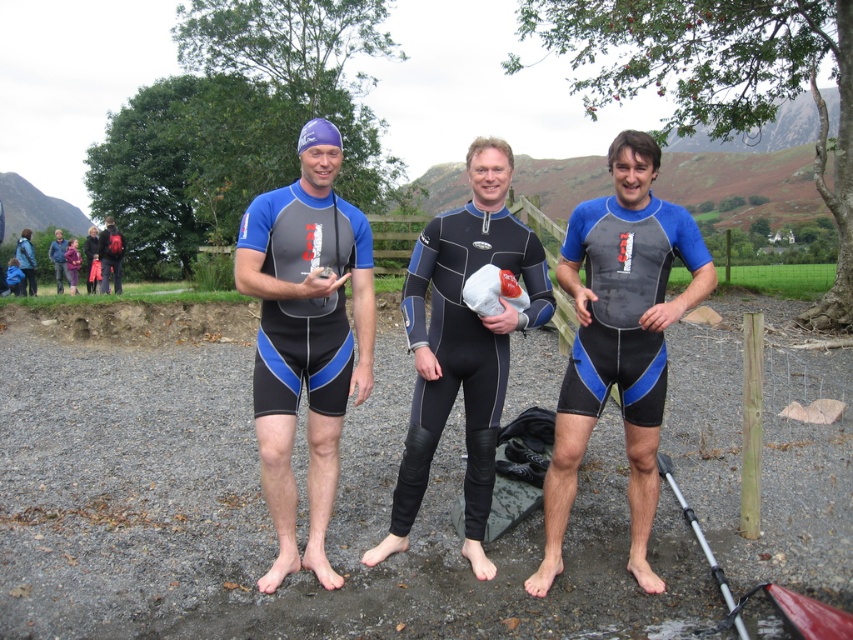
Consider the image. You are a photographer positioned behind the three people in the image. You want to take a photo that includes both the matte black wetsuit at left and the matte black wetsuit at center. Which one will appear closer to the camera in the photo?

The matte black wetsuit at left will appear closer to the camera in the photo because it is further to the viewer than the matte black wetsuit at center, meaning it is positioned nearer to the photographer.

You are navigating a drone over the scene and need to drop a lifebuoy to the person in the matte black wetsuit at left. Given the coordinates provided, can you confirm the exact location to drop it?

The matte black wetsuit at left is located at point (x=305, y=337), so the lifebuoy should be dropped there.

You are standing in the gravelly area near the water and want to walk from point A to point B. Point A is at coordinates point (316, 323) and point B is at point (428, 365). Which direction should you move to get from point A to point B?

To move from point A to point B, you should move downward and to the right. Since point A is further towards the camera than point B, moving towards the lower part of the image would take you away from the camera, aligning with the coordinate system where lower Y values are closer to the camera. However, since the Y coordinate increases from top to bottom, moving from 0.372 to 0.504 means moving downward in the image. The X coordinate increases from left to right, so moving from 0.505 to 0.572 means moving